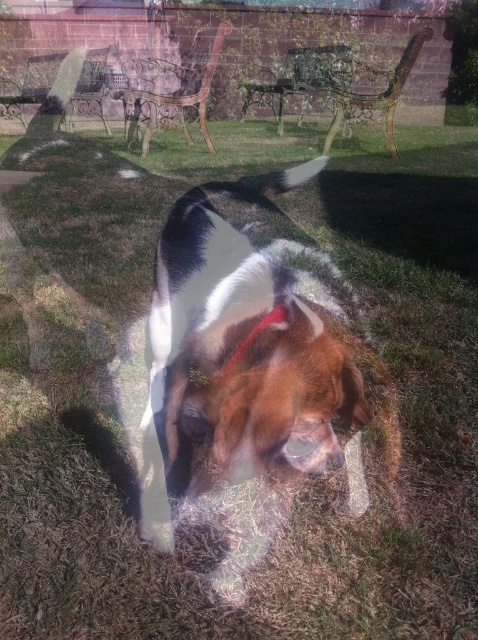
From the picture: Between brown and white fur dog at center and red fabric neckband at center, which one has more height?

With more height is brown and white fur dog at center.

Measure the distance from brown and white fur dog at center to red fabric neckband at center.

17.65 inches

Between point (295, 483) and point (223, 374), which one is positioned behind?

The point (295, 483) is behind.

The width and height of the screenshot is (478, 640). I want to click on brown and white fur dog at center, so click(242, 374).